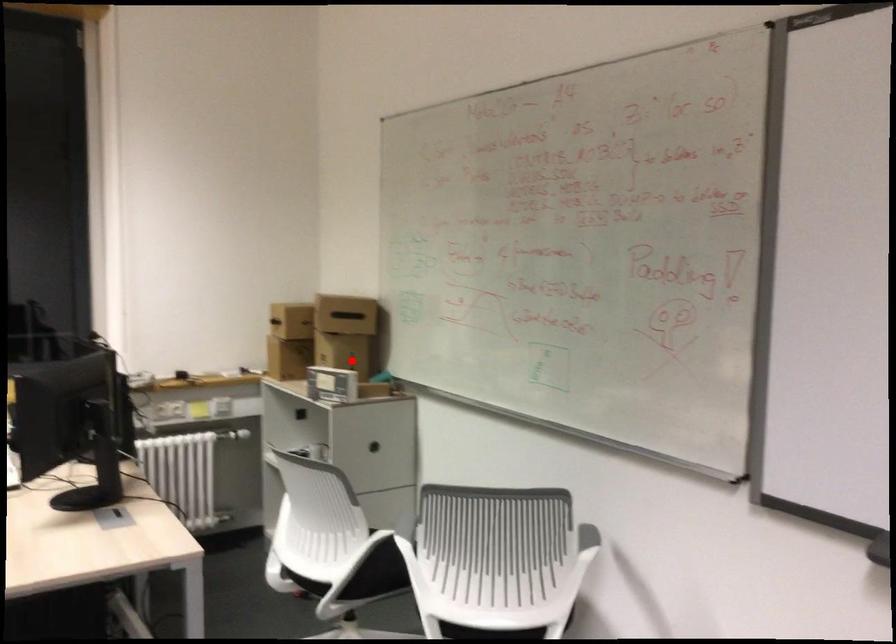
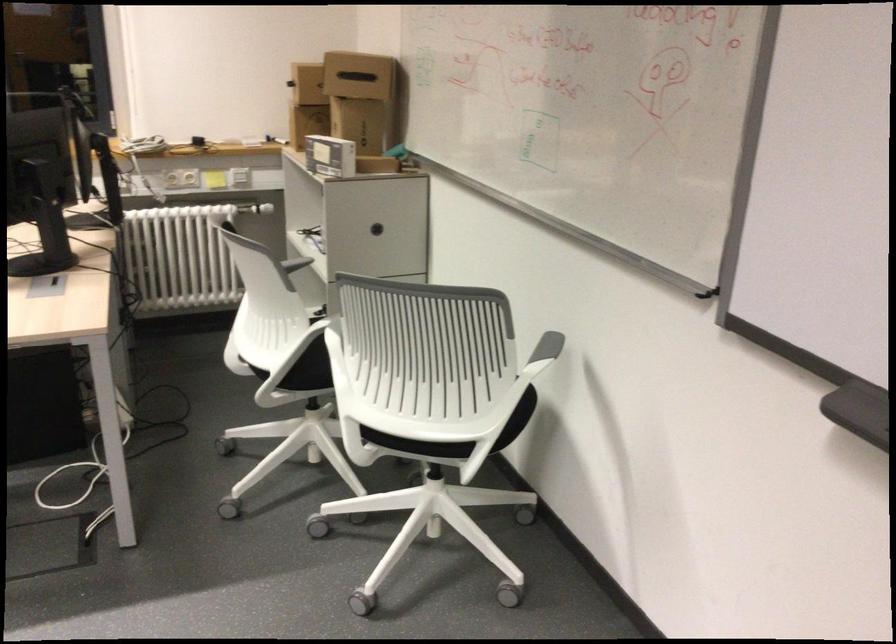
Question: A red point is marked in image1. In image2, is the corresponding 3D point closer to the camera or farther? Reply with the corresponding letter.

Choices:
 (A) The corresponding 3D point is closer.
 (B) The corresponding 3D point is farther.

Answer: (A)